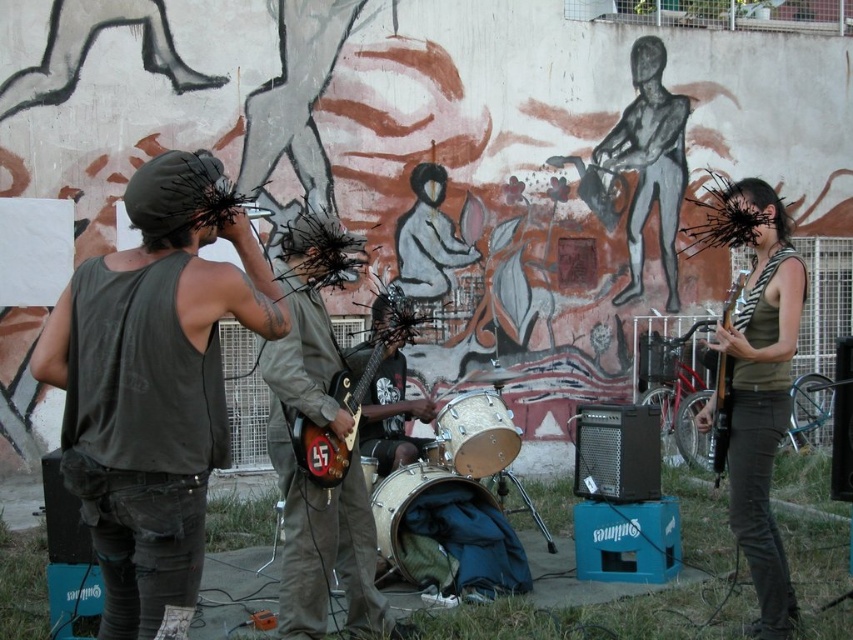
Question: Can you confirm if dark green sleeveless shirt at left is smaller than silver metallic drum at center?

Choices:
 (A) no
 (B) yes

Answer: (A)

Question: Which of the following is the closest to the observer?

Choices:
 (A) matte olive green tank top at right
 (B) silver metallic drum at center
 (C) camouflage fabric drum at center

Answer: (A)

Question: Which object is farther from the camera taking this photo?

Choices:
 (A) matte olive green tank top at right
 (B) matte black electric guitar at right
 (C) glossy wood guitar at center

Answer: (B)

Question: Which is nearer to the pearl drum kit at center?

Choices:
 (A) dark green sleeveless shirt at left
 (B) silver metallic drum at center
 (C) matte brown guitar at center
 (D) camouflage fabric drum at center

Answer: (B)

Question: Is dark green sleeveless shirt at left closer to the viewer compared to black matte hair at upper right?

Choices:
 (A) no
 (B) yes

Answer: (B)

Question: Can you confirm if glossy wood guitar at center is positioned to the right of matte black electric guitar at right?

Choices:
 (A) yes
 (B) no

Answer: (B)